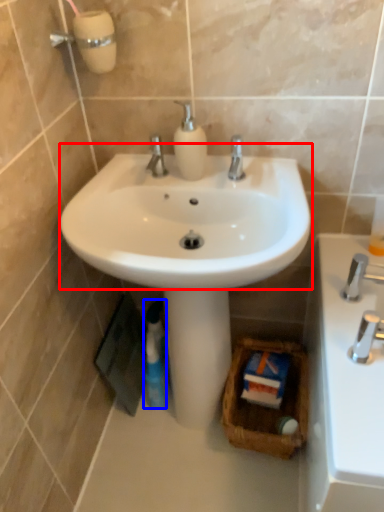
Question: Which of the following is the closest to the observer, sink (highlighted by a red box) or mouthwash (highlighted by a blue box)?

Choices:
 (A) sink
 (B) mouthwash

Answer: (A)